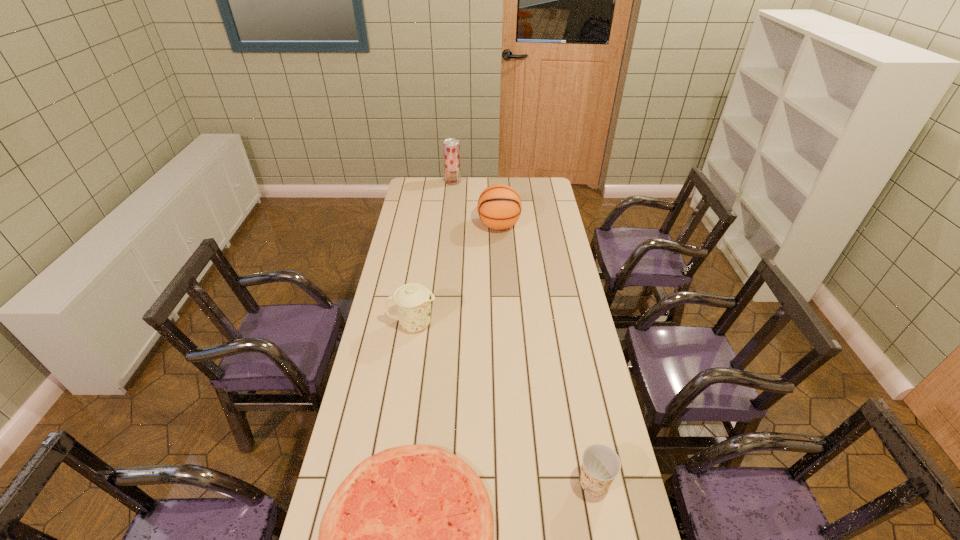
You are a GUI agent. You are given a task and a screenshot of the screen. Output one action in this format:
    pyautogui.click(x=<x>, y=<y>)
    Task: Click on the empty location between the rightmost object and the fourth nearest object
    Image resolution: width=960 pixels, height=540 pixels.
    Given the screenshot: What is the action you would take?
    pyautogui.click(x=546, y=354)

Identify the location of empty space between the second farthest object and the fruit juice. The image size is (960, 540). (476, 204).

Identify the location of the second closest object to the basketball. (413, 300).

Find the location of a particular element. This screenshot has width=960, height=540. object that ranks as the second closest to the pizza is located at coordinates (413, 300).

This screenshot has height=540, width=960. In order to click on vacant area that satisfies the following two spatial constraints: 1. on the spout of the second shortest object; 2. on the left side of the chinaware in this screenshot , I will do `click(388, 483)`.

Where is `vacant space that satisfies the following two spatial constraints: 1. on the spout of the third farthest object; 2. on the back side of the second shortest object`? The width and height of the screenshot is (960, 540). vacant space that satisfies the following two spatial constraints: 1. on the spout of the third farthest object; 2. on the back side of the second shortest object is located at coordinates [x=388, y=483].